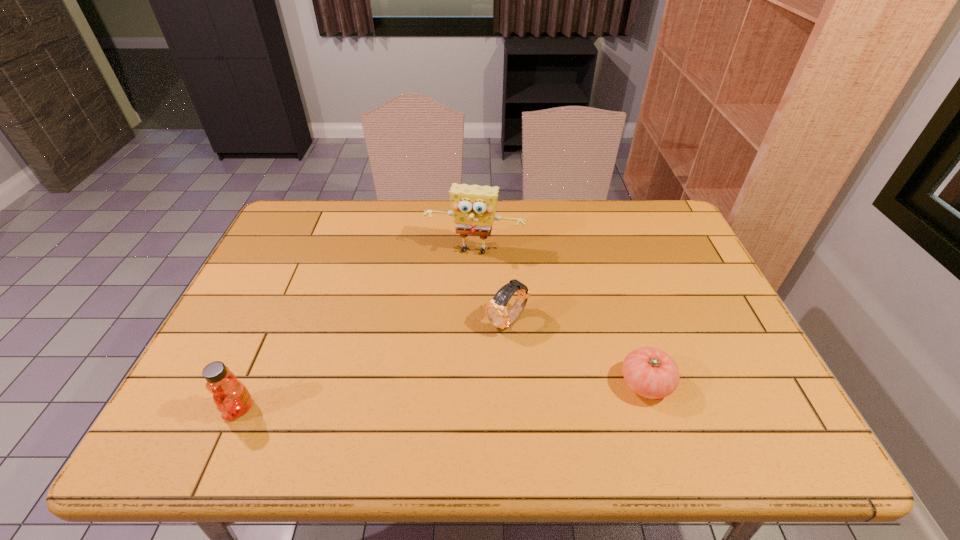
The height and width of the screenshot is (540, 960). I want to click on free space located on the face of the second farthest object, so click(426, 394).

You are a GUI agent. You are given a task and a screenshot of the screen. Output one action in this format:
    pyautogui.click(x=<x>, y=<y>)
    Task: Click on the free space located on the face of the second farthest object
    The height and width of the screenshot is (540, 960).
    Given the screenshot: What is the action you would take?
    (440, 382)

Locate an element on the screen. The image size is (960, 540). blank space located 0.180m on the face of the farthest object is located at coordinates (456, 306).

At what (x,y) coordinates should I click in order to perform the action: click on free spot located 0.050m on the face of the farthest object. Please return your answer as a coordinate pair (x, y). This screenshot has width=960, height=540. Looking at the image, I should click on [465, 274].

Locate an element on the screen. vacant space located on the face of the farthest object is located at coordinates (457, 303).

Find the location of `object that is at the far edge`. object that is at the far edge is located at coordinates (473, 206).

Where is `honey present at the near edge`? honey present at the near edge is located at coordinates (232, 398).

The height and width of the screenshot is (540, 960). What are the coordinates of `tomato that is at the near edge` in the screenshot? It's located at (652, 373).

Find the location of a particular element. The image size is (960, 540). object located at the left edge is located at coordinates (232, 398).

Identify the location of object present at the near left corner. The width and height of the screenshot is (960, 540). click(x=232, y=398).